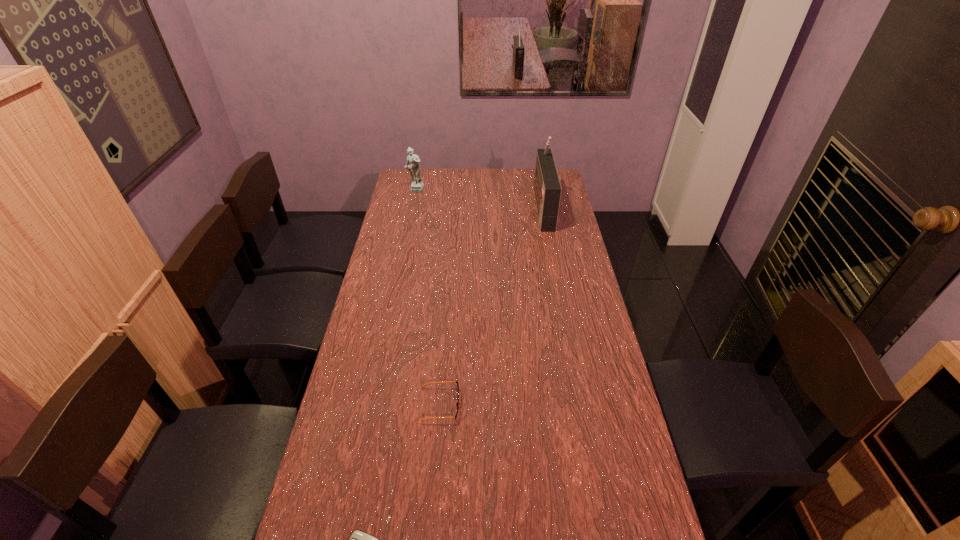
I want to click on the tallest object, so click(x=547, y=189).

The image size is (960, 540). Find the location of `the rightmost object`. the rightmost object is located at coordinates (547, 189).

Find the location of a particular element. The width and height of the screenshot is (960, 540). figurine is located at coordinates (417, 185).

Image resolution: width=960 pixels, height=540 pixels. In order to click on the third object from left to right in this screenshot , I will do `click(457, 403)`.

Where is `the second shortest object`? This screenshot has width=960, height=540. the second shortest object is located at coordinates (457, 403).

Find the location of a particular element. blank space located 0.190m on the front panel of the tallest object is located at coordinates (494, 207).

Identify the location of vacant space located 0.180m on the front panel of the tallest object. (496, 207).

You are a GUI agent. You are given a task and a screenshot of the screen. Output one action in this format:
    pyautogui.click(x=<x>, y=<y>)
    Task: Click on the free space located 0.330m on the front panel of the tallest object
    The height and width of the screenshot is (540, 960).
    Given the screenshot: What is the action you would take?
    pyautogui.click(x=465, y=207)

The height and width of the screenshot is (540, 960). I want to click on vacant area situated 0.080m on the front-facing side of the figurine, so click(x=412, y=204).

Where is `vacant area situated 0.080m on the front-facing side of the second nearest object`? The image size is (960, 540). vacant area situated 0.080m on the front-facing side of the second nearest object is located at coordinates (487, 404).